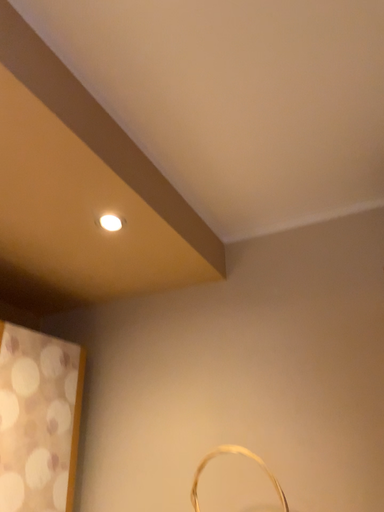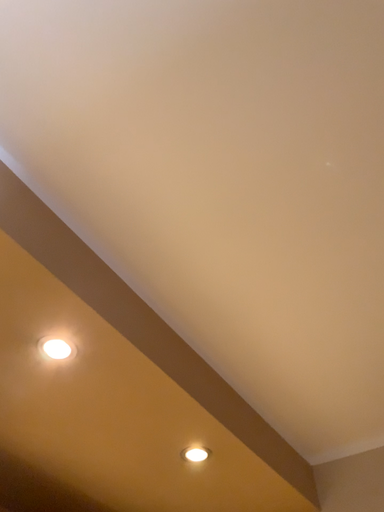
Question: How did the camera likely rotate when shooting the video?

Choices:
 (A) rotated right
 (B) rotated left

Answer: (B)